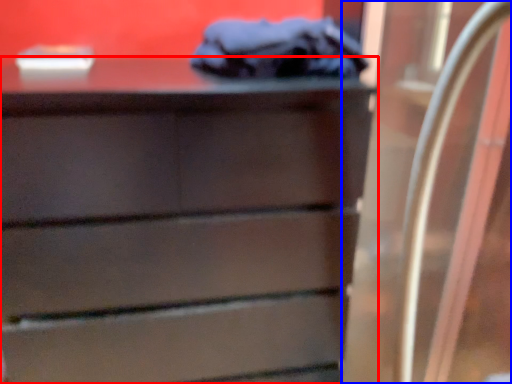
Question: Which point is closer to the camera, chest of drawers (highlighted by a red box) or glass door (highlighted by a blue box)?

Choices:
 (A) chest of drawers
 (B) glass door

Answer: (B)